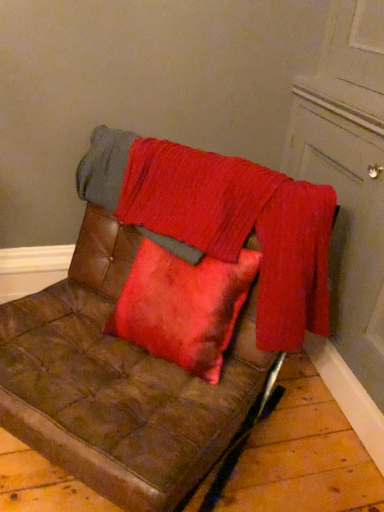
Measure the distance between point (4, 324) and camera.

Point (4, 324) and camera are 1.18 meters apart.

Measure the distance between velvet red blanket at center and camera.

velvet red blanket at center and camera are 1.07 meters apart from each other.

What is the approximate height of matte white door at upper right?

matte white door at upper right is 3.94 feet tall.

The image size is (384, 512). I want to click on matte white door at upper right, so click(349, 177).

This screenshot has width=384, height=512. What are the coordinates of `brown leather couch at center` in the screenshot? It's located at (161, 325).

Is matte white door at upper right at the back of velvet red blanket at center?

Yes, matte white door at upper right is at the back of velvet red blanket at center.

Based on the photo, which of these two, velvet red blanket at center or matte white door at upper right, stands taller?

matte white door at upper right.

Considering the relative positions of velvet red blanket at center and matte white door at upper right in the image provided, is velvet red blanket at center to the right of matte white door at upper right from the viewer's perspective?

Incorrect, velvet red blanket at center is not on the right side of matte white door at upper right.

At what (x,y) coordinates should I click in order to perform the action: click on blanket lying behind the matte white door at upper right. Please return your answer as a coordinate pair (x, y). The height and width of the screenshot is (512, 384). Looking at the image, I should click on (222, 220).

Is the position of brown leather couch at center less distant than that of velvet red blanket at center?

Yes, it is in front of velvet red blanket at center.

From a real-world perspective, is brown leather couch at center on velvet red blanket at center?

No, from a real-world perspective, brown leather couch at center is not above velvet red blanket at center.

Who is smaller, brown leather couch at center or velvet red blanket at center?

With smaller size is velvet red blanket at center.

Between matte white door at upper right and velvet red blanket at center, which one has larger size?

With larger size is matte white door at upper right.

Looking at this image, what's the angular difference between matte white door at upper right and velvet red blanket at center's facing directions?

The angle between the facing direction of matte white door at upper right and the facing direction of velvet red blanket at center is 46 degrees.

Considering the positions of objects matte white door at upper right and velvet red blanket at center in the image provided, who is behind, matte white door at upper right or velvet red blanket at center?

Positioned behind is velvet red blanket at center.

Identify the location of door that appears on the right of velvet red blanket at center. (349, 177).

Which is in front, point (266, 294) or point (338, 294)?

The point (266, 294) is more forward.

Visually, is brown leather couch at center positioned to the left or to the right of matte white door at upper right?

Clearly, brown leather couch at center is on the left of matte white door at upper right in the image.

Is brown leather couch at center not inside matte white door at upper right?

Yes, brown leather couch at center is not within matte white door at upper right.

Choose the correct answer: Is matte white door at upper right inside brown leather couch at center or outside it?

matte white door at upper right cannot be found inside brown leather couch at center.

The image size is (384, 512). Find the location of `furniture lying below the matte white door at upper right (from the image's perspective)`. furniture lying below the matte white door at upper right (from the image's perspective) is located at coordinates (161, 325).

Considering the positions of points (361, 288) and (220, 367), is point (361, 288) farther from camera compared to point (220, 367)?

Yes, point (361, 288) is farther from viewer.

From the image's perspective, which object appears higher, matte white door at upper right or brown leather couch at center?

matte white door at upper right is shown above in the image.

Is velvet red blanket at center at the left side of brown leather couch at center?

No, velvet red blanket at center is not to the left of brown leather couch at center.

Is brown leather couch at center a part of velvet red blanket at center?

That's incorrect, brown leather couch at center is not inside velvet red blanket at center.

Locate an element on the screen. This screenshot has width=384, height=512. furniture that is under the velvet red blanket at center (from a real-world perspective) is located at coordinates (161, 325).

How different are the orientations of velvet red blanket at center and brown leather couch at center in degrees?

0.000982 degrees.

Find the location of `door above the velvet red blanket at center (from a real-world perspective)`. door above the velvet red blanket at center (from a real-world perspective) is located at coordinates (349, 177).

Where is `blanket behind the brown leather couch at center`? blanket behind the brown leather couch at center is located at coordinates (222, 220).

From the image, which object appears to be nearer to velvet red blanket at center, matte white door at upper right or brown leather couch at center?

brown leather couch at center.

Based on their spatial positions, is brown leather couch at center or velvet red blanket at center closer to matte white door at upper right?

velvet red blanket at center is closer to matte white door at upper right.

Estimate the real-world distances between objects in this image. Which object is closer to brown leather couch at center, matte white door at upper right or velvet red blanket at center?

velvet red blanket at center is closer to brown leather couch at center.

Looking at the image, which one is located further to brown leather couch at center, velvet red blanket at center or matte white door at upper right?

The object further to brown leather couch at center is matte white door at upper right.

When comparing their distances from matte white door at upper right, does velvet red blanket at center or brown leather couch at center seem further?

Based on the image, brown leather couch at center appears to be further to matte white door at upper right.

Looking at this image, considering their positions, is brown leather couch at center positioned further to velvet red blanket at center than matte white door at upper right?

The object further to velvet red blanket at center is matte white door at upper right.

Identify the location of blanket between brown leather couch at center and matte white door at upper right. (222, 220).